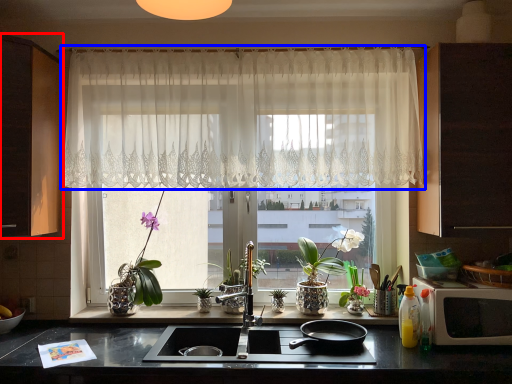
Question: Which object appears closest to the camera in this image, cabinetry (highlighted by a red box) or curtain (highlighted by a blue box)?

Choices:
 (A) cabinetry
 (B) curtain

Answer: (A)